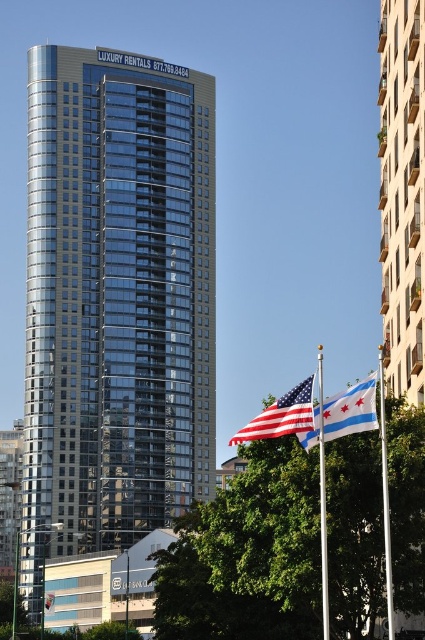
Question: Which is farther from the blue and white striped fabric at center?

Choices:
 (A) white glossy flag pole at center
 (B) silver metallic flag pole at center
 (C) american flag at center
 (D) green leafy tree at lower center

Answer: (B)

Question: In this image, where is glassy concrete building at right located relative to silver metallic flag pole at center?

Choices:
 (A) left
 (B) right

Answer: (A)

Question: In this image, where is american flag at center located relative to silver metallic flag pole at center?

Choices:
 (A) below
 (B) above

Answer: (A)

Question: Which of the following is the closest to the observer?

Choices:
 (A) (189, 374)
 (B) (322, 493)

Answer: (B)

Question: Is the position of glassy concrete building at right more distant than that of white glossy flag pole at center?

Choices:
 (A) yes
 (B) no

Answer: (A)

Question: Which object is positioned farthest from the silver metallic flag pole at center?

Choices:
 (A) blue and white striped fabric at center
 (B) american flag at center
 (C) glassy concrete building at right

Answer: (A)